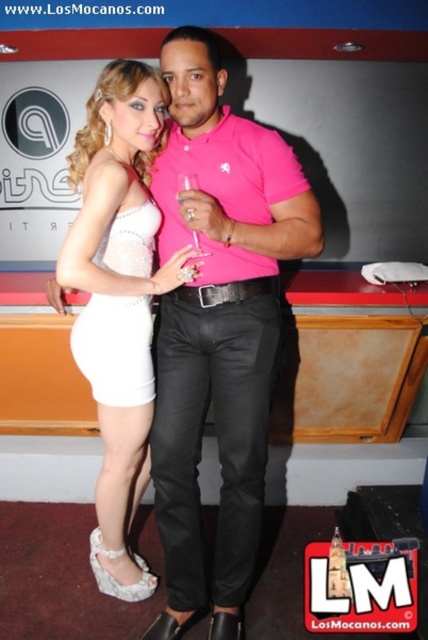
Question: Which point is farther to the camera?

Choices:
 (A) white lace dress at left
 (B) matte white dress at center
 (C) transparent glass at center
 (D) white satin dress at center

Answer: (A)

Question: Can you confirm if matte white dress at center is thinner than white satin dress at center?

Choices:
 (A) yes
 (B) no

Answer: (B)

Question: Is white satin dress at center closer to camera compared to white lace dress at left?

Choices:
 (A) no
 (B) yes

Answer: (B)

Question: Which object is farther from the camera taking this photo?

Choices:
 (A) white satin dress at center
 (B) transparent glass at center

Answer: (A)

Question: Can you confirm if white lace dress at left is positioned to the left of transparent glass at center?

Choices:
 (A) yes
 (B) no

Answer: (A)

Question: Estimate the real-world distances between objects in this image. Which object is closer to the matte white dress at center?

Choices:
 (A) transparent glass at center
 (B) white lace dress at left

Answer: (B)